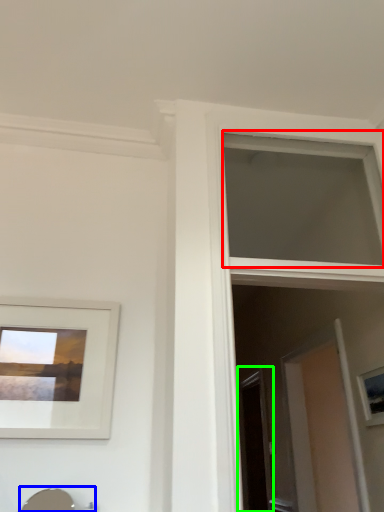
Question: Which object is positioned farthest from window (highlighted by a red box)? Select from sink (highlighted by a blue box) and screen door (highlighted by a green box).

Choices:
 (A) sink
 (B) screen door

Answer: (A)